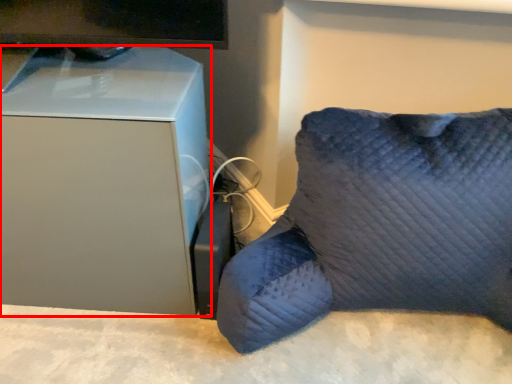
Question: From the image's perspective, where is furniture (annotated by the red box) located relative to furniture?

Choices:
 (A) below
 (B) above

Answer: (B)